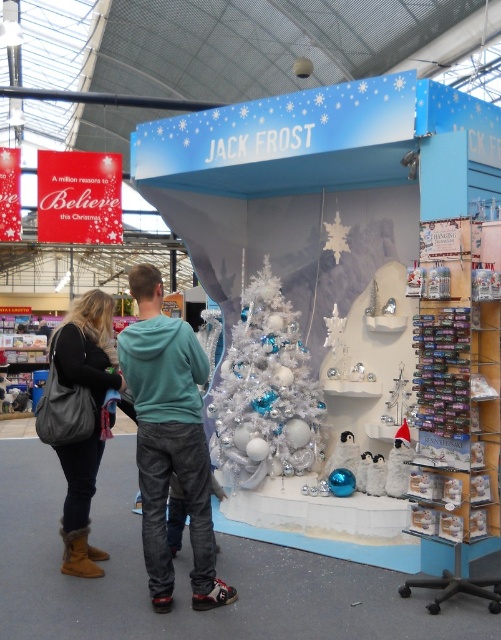
Describe the element at coordinates (155, 424) in the screenshot. I see `leather jacket at center` at that location.

Who is higher up, leather jacket at center or leather boots at lower left?

Positioned higher is leather jacket at center.

Identify the location of leather jacket at center. (155, 424).

Is point (275, 337) closer to viewer compared to point (74, 428)?

That is False.

Does white glossy christmas tree at center appear over leather boots at lower left?

Yes.

Image resolution: width=501 pixels, height=640 pixels. I want to click on white glossy christmas tree at center, so click(x=266, y=394).

Which is below, leather jacket at center or white glossy christmas tree at center?

leather jacket at center is lower down.

Does leather jacket at center appear over white glossy christmas tree at center?

Incorrect, leather jacket at center is not positioned above white glossy christmas tree at center.

Measure the distance between leather jacket at center and camera.

leather jacket at center and camera are 3.47 meters apart from each other.

The height and width of the screenshot is (640, 501). I want to click on leather jacket at center, so click(x=155, y=424).